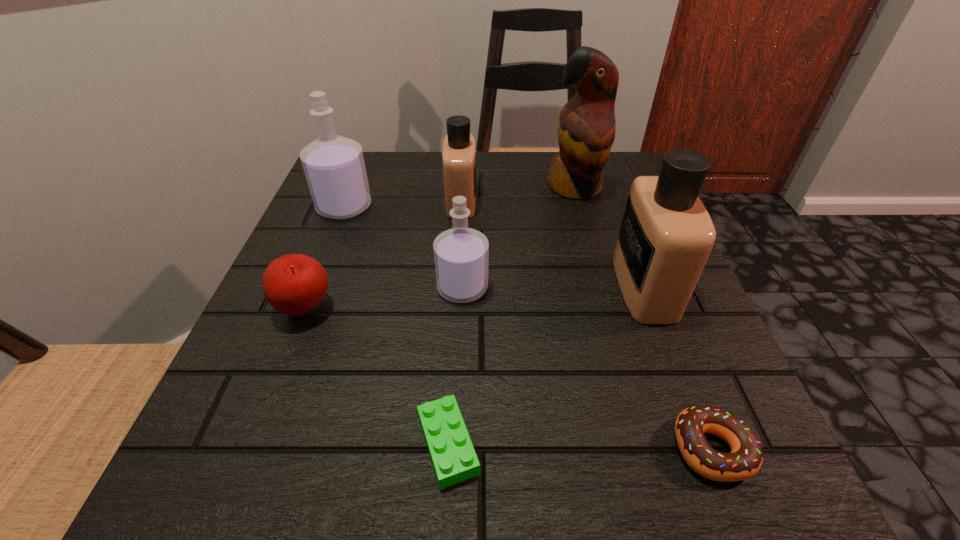
This screenshot has width=960, height=540. I want to click on free location at the right edge, so click(604, 209).

The width and height of the screenshot is (960, 540). What are the coordinates of `vacant area at the far left corner` in the screenshot? It's located at (395, 163).

Find the location of `vacant region between the tallest object and the left beige perfume`. vacant region between the tallest object and the left beige perfume is located at coordinates (517, 194).

The width and height of the screenshot is (960, 540). Identify the location of free space between the red parrot and the bigger beige perfume. (610, 237).

Find the location of a particular element. vacant space that's between the bigger beige perfume and the right purple perfume is located at coordinates (553, 287).

You are a GUI agent. You are given a task and a screenshot of the screen. Output one action in this format:
    pyautogui.click(x=<x>, y=<y>)
    Task: Click on the vacant point located between the green Lego and the second shortest object
    
    Given the screenshot: What is the action you would take?
    pyautogui.click(x=581, y=447)

You are a GUI agent. You are given a task and a screenshot of the screen. Output one action in this format:
    pyautogui.click(x=<x>, y=<y>)
    Task: Click on the free point between the parrot and the nearer beige perfume
    The height and width of the screenshot is (540, 960).
    Given the screenshot: What is the action you would take?
    pyautogui.click(x=610, y=237)

Where is `vacant area that lies between the right purple perfume and the Lego`? This screenshot has width=960, height=540. vacant area that lies between the right purple perfume and the Lego is located at coordinates (455, 366).

This screenshot has width=960, height=540. Identify the location of vacant point located between the left beige perfume and the Lego. (454, 322).

Where is `blank region between the third shortest object and the shortest object`? blank region between the third shortest object and the shortest object is located at coordinates (376, 376).